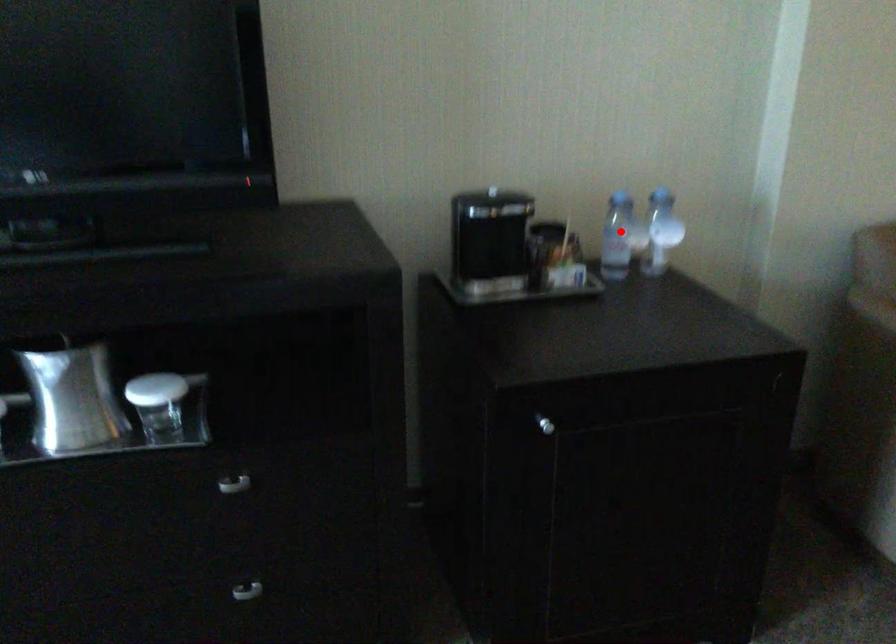
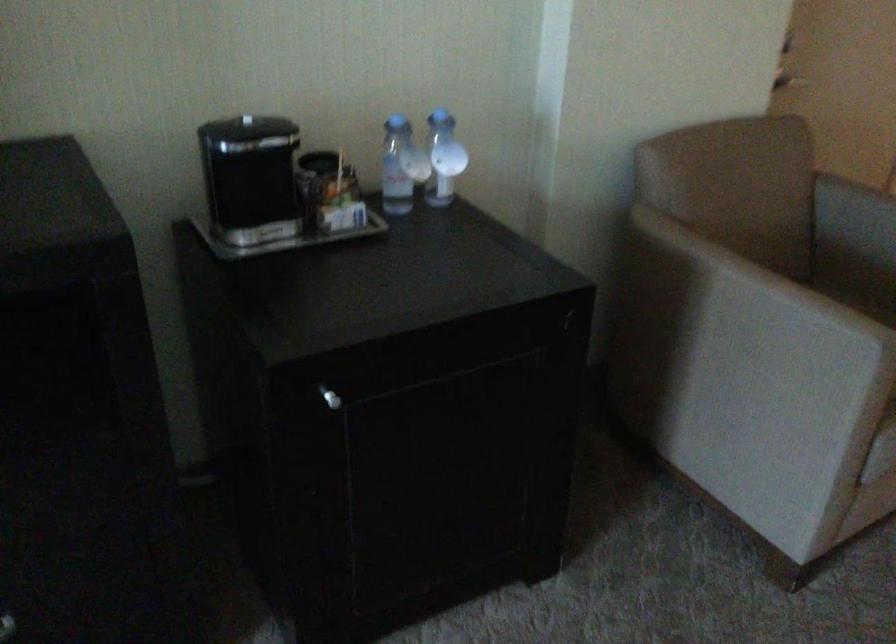
Question: I am providing you with two images of the same scene from different viewpoints. Given a red point in image1, look at the same physical point in image2. Is it:

Choices:
 (A) Closer to the viewpoint
 (B) Farther from the viewpoint

Answer: (A)